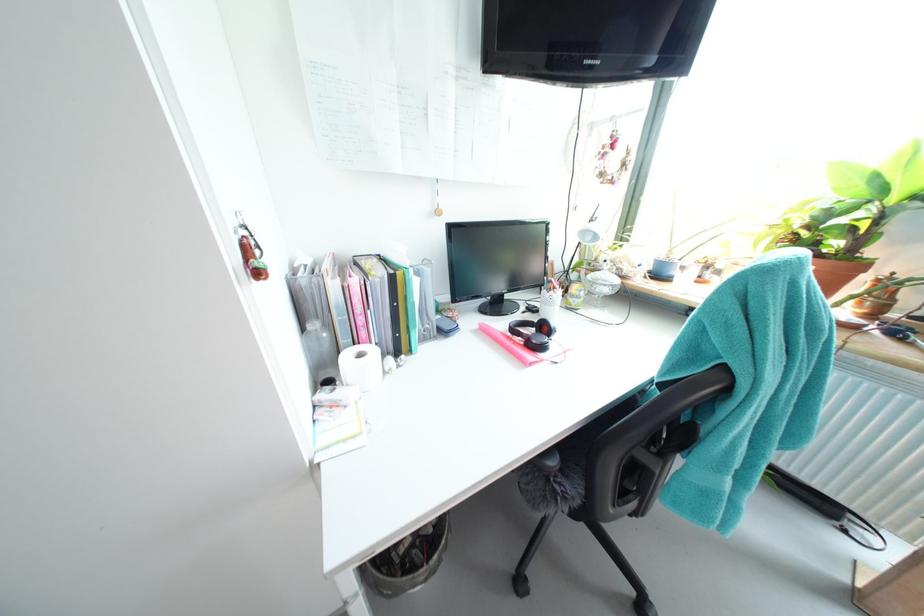
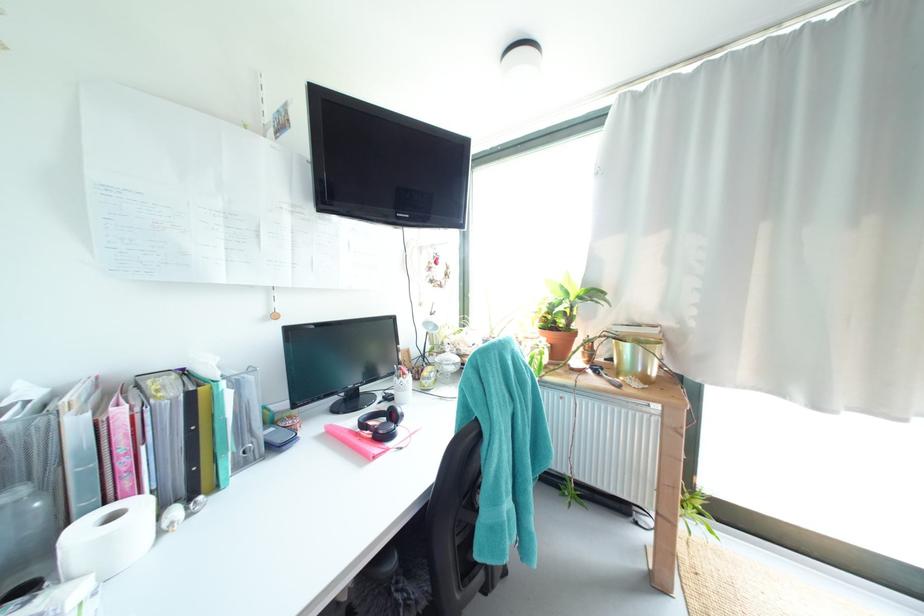
Find the pixel in the second image that matches the point at 861,230 in the first image.

(573, 315)